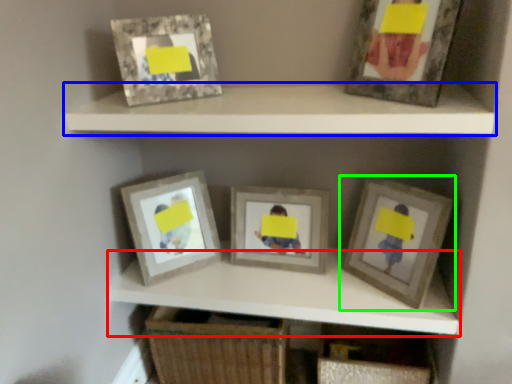
Question: Which object is the farthest from cabinet (highlighted by a red box)? Choose among these: shelf (highlighted by a blue box) or picture frame (highlighted by a green box).

Choices:
 (A) shelf
 (B) picture frame

Answer: (A)